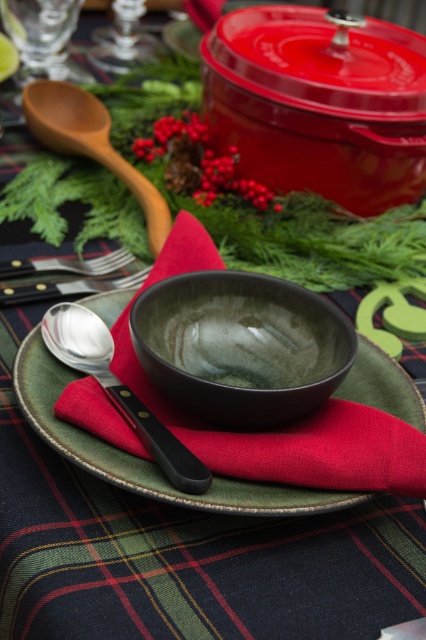
Can you confirm if black plastic knife at left is positioned below silver metallic fork at lower left?

Yes, black plastic knife at left is below silver metallic fork at lower left.

Is point (123, 285) closer to camera compared to point (20, 269)?

That is True.

Identify the location of black plastic knife at left. click(71, 285).

Does silver metallic spoon at center lie in front of silver metallic fork at lower left?

That is True.

Who is taller, silver metallic spoon at center or silver metallic fork at lower left?

silver metallic spoon at center is taller.

Is point (66, 333) farther from viewer compared to point (69, 259)?

No, it is not.

Where is `silver metallic spoon at center`? The height and width of the screenshot is (640, 426). silver metallic spoon at center is located at coordinates (118, 388).

Between point (97, 125) and point (51, 269), which one is positioned behind?

Point (97, 125)

Does wooden spoon at upper left have a lesser width compared to silver metallic fork at lower left?

No, wooden spoon at upper left is not thinner than silver metallic fork at lower left.

Is point (126, 164) behind point (117, 260)?

Yes, it is.

This screenshot has height=640, width=426. I want to click on wooden spoon at upper left, so click(91, 144).